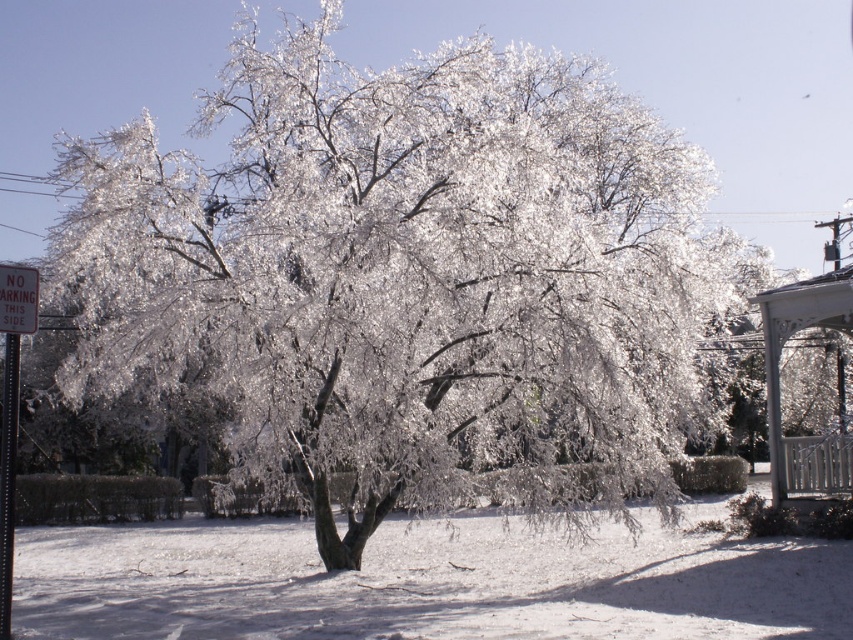
The height and width of the screenshot is (640, 853). What do you see at coordinates (779, 378) in the screenshot? I see `white painted wood gazebo at right` at bounding box center [779, 378].

Who is more distant from viewer, (759, 310) or (9, 291)?

The point (759, 310) is more distant.

Does point (825, 464) come behind point (28, 326)?

Yes, it is behind point (28, 326).

Find the location of `white painted wood gazebo at right`. white painted wood gazebo at right is located at coordinates (779, 378).